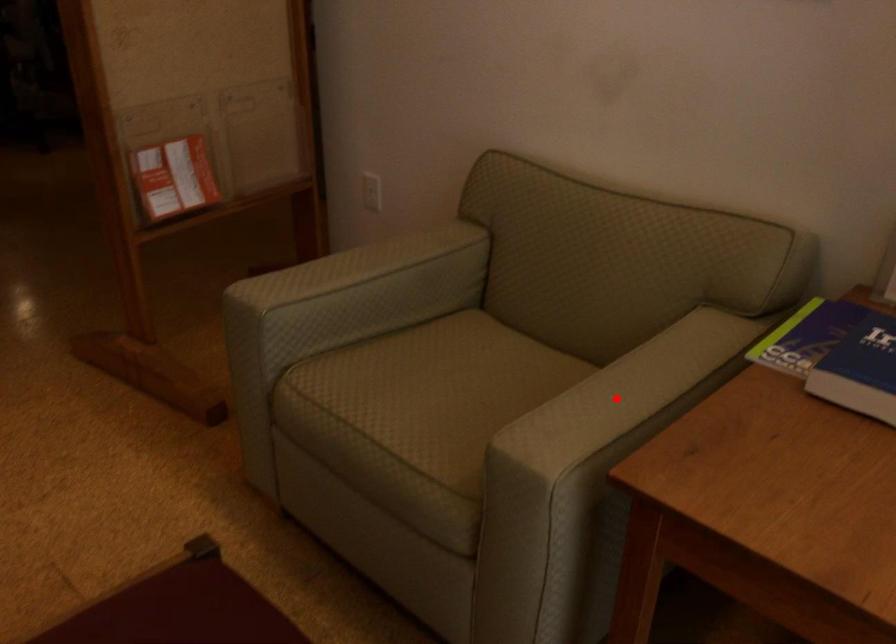
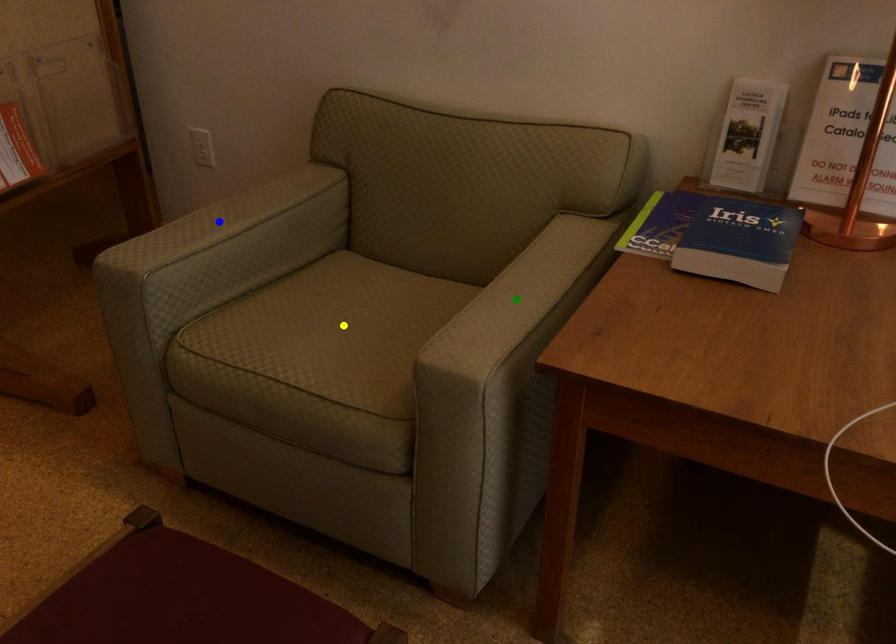
Question: I am providing you with two images of the same scene from different viewpoints. A red point is marked on the first image. You are given multiple points on the second image. In image 2, which mark is for the same physical point as the one in image 1?

Choices:
 (A) yellow point
 (B) green point
 (C) blue point

Answer: (B)